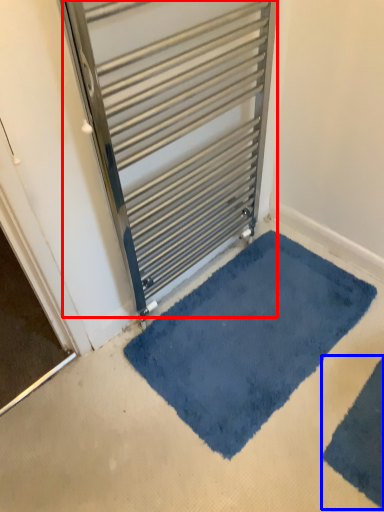
Question: Which point is further to the camera, door (highlighted by a red box) or bath mat (highlighted by a blue box)?

Choices:
 (A) door
 (B) bath mat

Answer: (B)